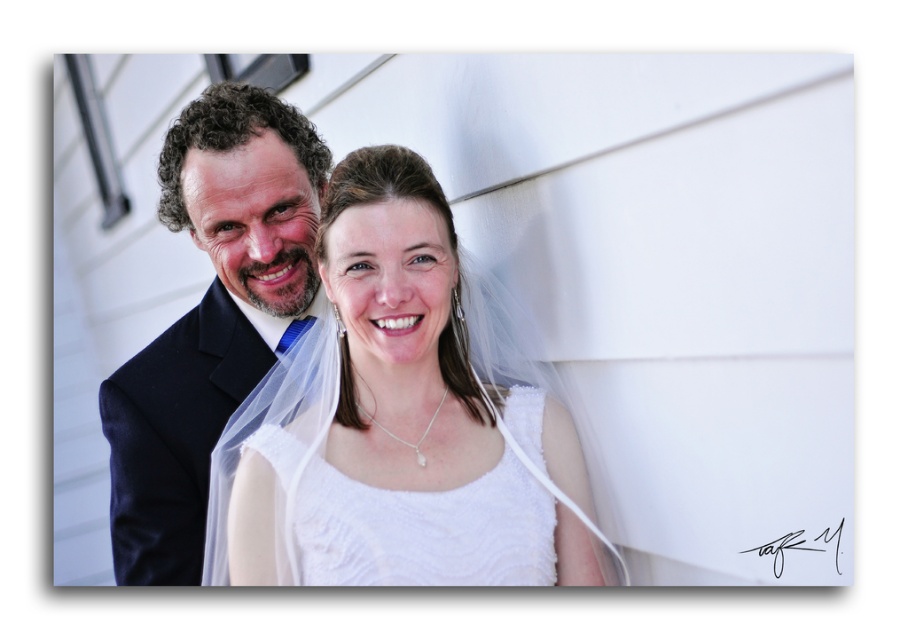
Does white lace dress at center have a lesser height compared to dark blue suit at left?

Yes, white lace dress at center is shorter than dark blue suit at left.

Who is more forward, (270, 508) or (218, 416)?

Point (270, 508) is in front.

Where is `white lace dress at center`? white lace dress at center is located at coordinates (398, 424).

Does dark blue suit at left appear over white textured fabric at center?

Indeed, dark blue suit at left is positioned over white textured fabric at center.

Between dark blue suit at left and white textured fabric at center, which one is positioned lower?

white textured fabric at center

This screenshot has width=908, height=640. What do you see at coordinates (211, 317) in the screenshot? I see `dark blue suit at left` at bounding box center [211, 317].

Image resolution: width=908 pixels, height=640 pixels. I want to click on dark blue suit at left, so click(211, 317).

Which is in front, point (391, 296) or point (456, 541)?

Positioned in front is point (391, 296).

Which is in front, point (589, 500) or point (512, 570)?

Point (512, 570) is more forward.

Identify the location of white lace dress at center. This screenshot has height=640, width=908. (398, 424).